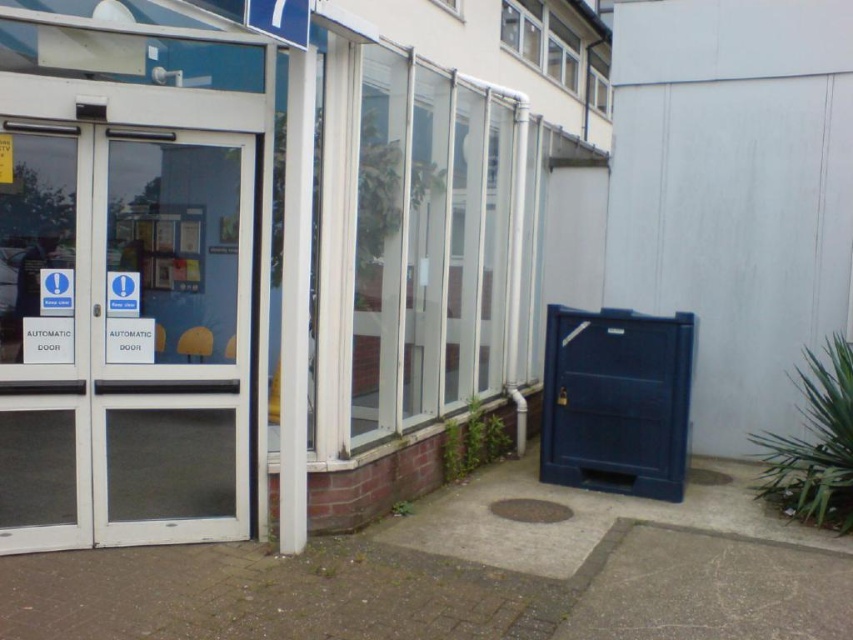
Consider the image. You are a delivery person with a cart that is 1.5 meters wide. You need to move through the space between the transparent glass door at left and the transparent glass door at center. Can your cart fit through the space between them?

The distance between the transparent glass door at left and the transparent glass door at center is 1.64 meters. Since your cart is 1.5 meters wide, it can fit through the space as the distance is slightly wider than the cart.

You are a delivery person trying to enter the building through the transparent glass door at left and the transparent glass door at center. Which door should you use if you need to carry a tall package that is 2 meters high?

The transparent glass door at center is taller than the transparent glass door at left, so you should use the transparent glass door at center to carry the tall package that is 2 meters high.

You are a delivery person approaching the entrance of the building. You need to deliver a package to the office located behind the transparent glass door at center. However, there is a transparent glass door at left in front of you. Which door should you pass through to reach the office?

You should pass through the transparent glass door at center because the transparent glass door at left is to the left of it, meaning the center door is further ahead on your path toward the office.